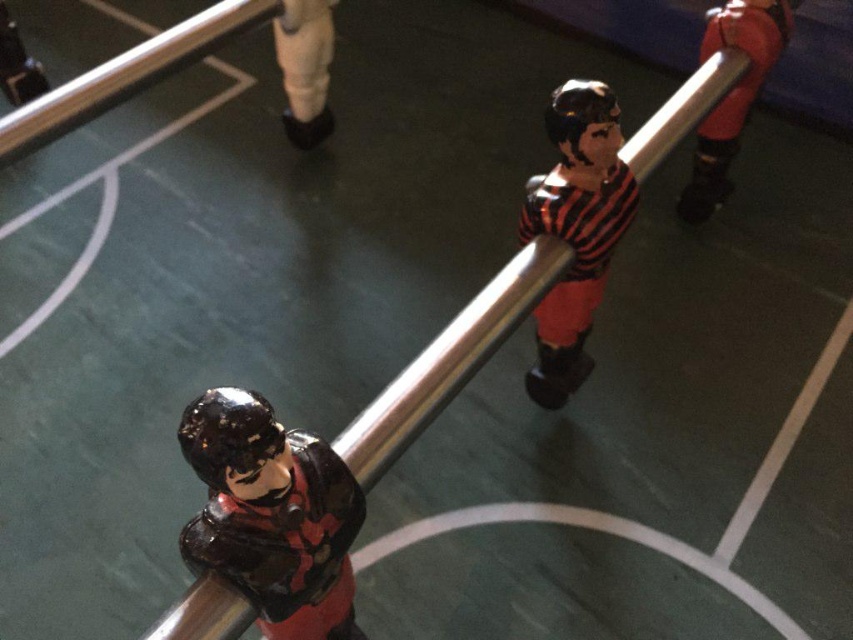
Question: Which is farther from the matte black figure at upper right?

Choices:
 (A) glossy plastic figure at center
 (B) metallic silver pole at center

Answer: (A)

Question: Which of the following is the farthest from the observer?

Choices:
 (A) matte black figure at upper right
 (B) metallic silver pole at center
 (C) black glossy figure at center
 (D) glossy plastic figure at center

Answer: (A)

Question: Does black glossy figure at center have a larger size compared to white matte leg at upper center?

Choices:
 (A) yes
 (B) no

Answer: (B)

Question: Is matte black figure at upper right thinner than white matte leg at upper center?

Choices:
 (A) yes
 (B) no

Answer: (A)

Question: Is metallic silver pole at center smaller than black glossy figure at center?

Choices:
 (A) yes
 (B) no

Answer: (A)

Question: Which point is farther to the camera?

Choices:
 (A) (219, 554)
 (B) (294, 131)
 (C) (757, 36)

Answer: (B)